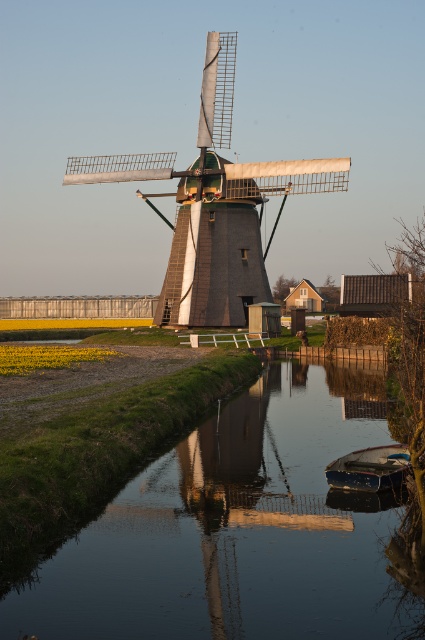
The image size is (425, 640). What do you see at coordinates (243, 531) in the screenshot?
I see `smooth reflective water at center` at bounding box center [243, 531].

Between smooth reflective water at center and blue wooden boat at lower right, which one has less height?

smooth reflective water at center is shorter.

Which is in front, point (34, 586) or point (379, 484)?

Point (34, 586)

Locate an element on the screen. The height and width of the screenshot is (640, 425). smooth reflective water at center is located at coordinates (243, 531).

Is wooden windmill at center below blue wooden boat at lower right?

No.

Is point (192, 216) positioned in front of point (362, 461)?

No, (192, 216) is further to viewer.

Who is more forward, (265, 285) or (368, 467)?

Point (368, 467) is in front.

The height and width of the screenshot is (640, 425). Identify the location of wooden windmill at center. (214, 204).

Which is in front, point (113, 580) or point (195, 211)?

Positioned in front is point (113, 580).

Is smooth reflective water at center positioned at the back of wooden windmill at center?

No, smooth reflective water at center is in front of wooden windmill at center.

Which is in front, point (340, 552) or point (207, 186)?

Point (340, 552) is more forward.

The height and width of the screenshot is (640, 425). What are the coordinates of `smooth reflective water at center` in the screenshot? It's located at (243, 531).